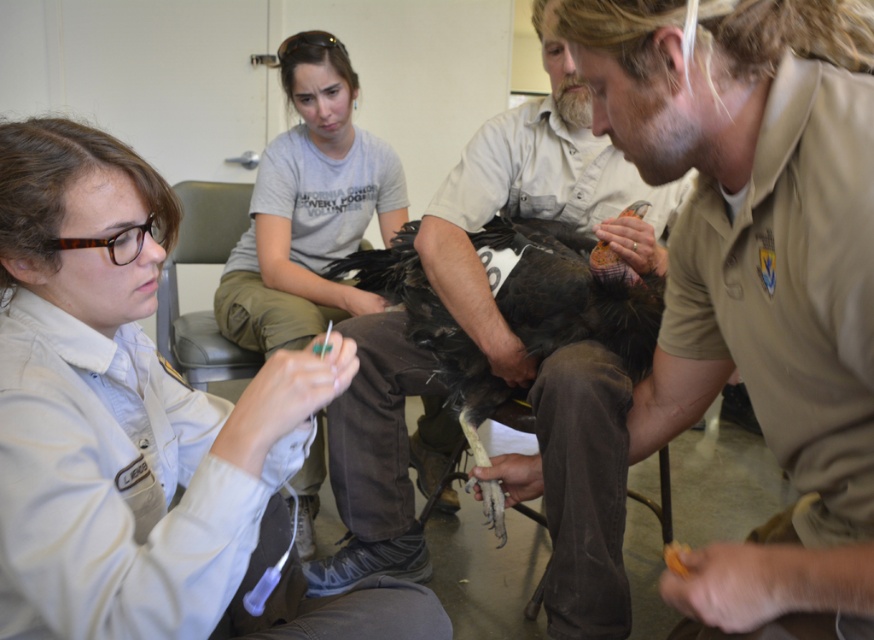
Looking at this image, you are a photographer standing at the entrance of the veterinary clinic. You need to capture a closeup shot of the gray cotton shirt at upper center and the dark brown feathers at center. The camera you are using has a maximum focus range of 35 centimeters. Can you take the photo without moving closer?

The gray cotton shirt at upper center is 36.03 centimeters from the dark brown feathers at center. Since the distance between them exceeds the camera maximum focus range of 35 centimeters, you cannot take the photo without moving closer.

You are standing in the veterinary clinic and need to hand a tool to the person wearing the brown leather jacket at center and the gray cotton shirt at upper center. Which person should you approach first to ensure you give them the tool without needing to move closer or farther from your current position?

You should approach the brown leather jacket at center first because it is closer to you than the gray cotton shirt at upper center, so you can reach them without moving closer or farther from your current position.

You are a visitor entering the clinic and need to sit down. You see the brown leather jacket at center and the gray leather chair at upper center. Which object can you sit on?

The gray leather chair at upper center is the object you can sit on, as the brown leather jacket at center is taller than the chair but jackets are not meant for sitting.